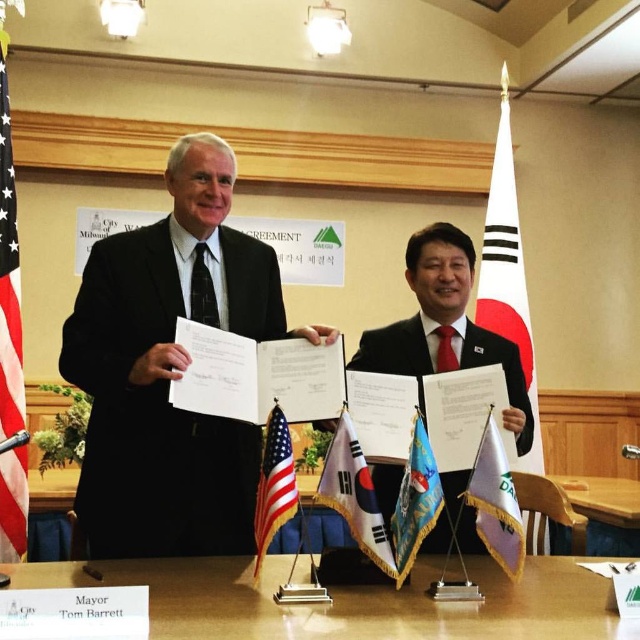
You are attending an official meeting and need to locate the American flag. Based on the coordinates provided, where would you find the american flag at left in relation to the individuals?

The american flag at left is positioned at point (8, 280), which places it to the left side of the scene relative to the individuals standing at the table.

You are a photographer who needs to capture a closeup shot of both the white fabric flag at center and the purple fabric flag at right in the scene. Given that your camera can only focus on objects within a 10 inch range, will you be able to capture both flags in a single focused shot?

The white fabric flag at center and purple fabric flag at right are 12.17 inches apart, which exceeds the camera focus range of 10 inches. Therefore, you cannot capture both flags in a single focused shot.